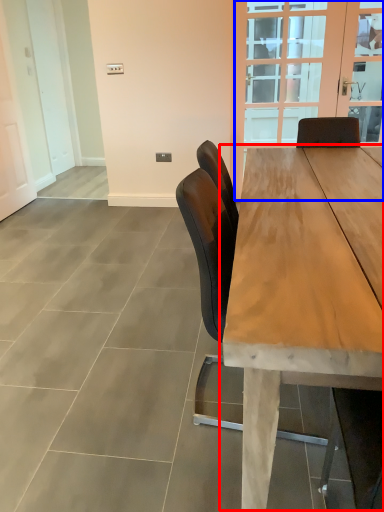
Question: Which point is closer to the camera, table (highlighted by a red box) or glass door (highlighted by a blue box)?

Choices:
 (A) table
 (B) glass door

Answer: (A)